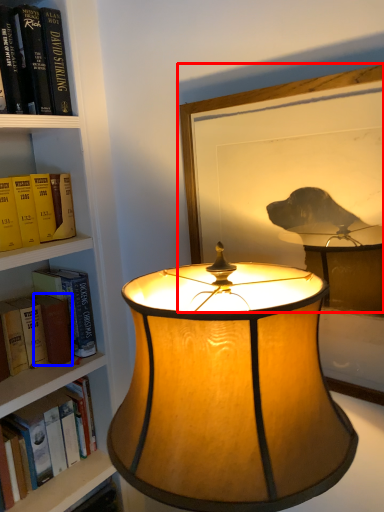
Question: Which point is further to the camera, picture frame (highlighted by a red box) or paperback book (highlighted by a blue box)?

Choices:
 (A) picture frame
 (B) paperback book

Answer: (B)